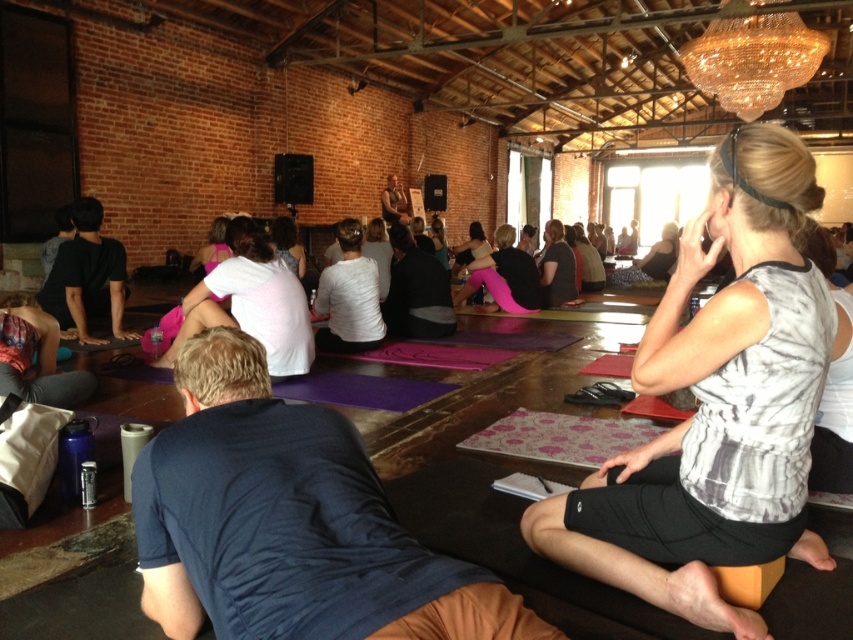
You are standing at the entrance of the yoga class and want to find the white cotton shirt at center. According to the coordinates provided, where should you look to find it?

The white cotton shirt at center is located at coordinates point 0.473 on the x axis and 0.295 on the y axis.

You are a photographer standing at the back of the room. You want to take a photo of the white printed tank top at center and the matte pink yoga mat at center. Can you fit both into your camera frame if your camera has a maximum field of view of 5 meters?

The distance between the white printed tank top at center and the matte pink yoga mat at center is 5.47 meters, which exceeds the camera frame of 5 meters. Therefore, you cannot fit both into the frame.